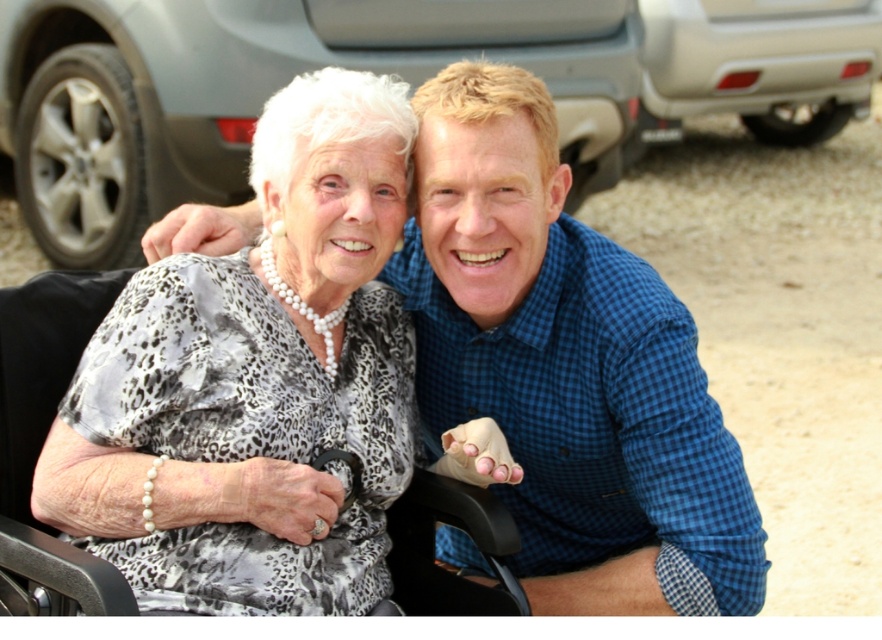
Does metallic gray car at upper center have a lesser height compared to silver metallic car at upper right?

Incorrect, metallic gray car at upper center's height does not fall short of silver metallic car at upper right's.

Is point (218, 193) more distant than point (686, 68)?

No, (218, 193) is in front of (686, 68).

This screenshot has height=640, width=882. In order to click on metallic gray car at upper center in this screenshot , I will do (x=258, y=92).

Which is behind, point (540, 600) or point (839, 51)?

Positioned behind is point (839, 51).

Does blue checkered shirt at center appear over silver metallic car at upper right?

Incorrect, blue checkered shirt at center is not positioned above silver metallic car at upper right.

Does point (699, 493) come in front of point (838, 97)?

Yes, point (699, 493) is closer to viewer.

The image size is (882, 640). I want to click on blue checkered shirt at center, so click(567, 368).

Consider the image. Between white pearl necklace at upper left and silver metallic car at upper right, which one is positioned higher?

Positioned higher is silver metallic car at upper right.

Find the location of a particular element. The width and height of the screenshot is (882, 640). white pearl necklace at upper left is located at coordinates (266, 372).

Describe the element at coordinates (266, 372) in the screenshot. I see `white pearl necklace at upper left` at that location.

Where is `white pearl necklace at upper left`? The height and width of the screenshot is (640, 882). white pearl necklace at upper left is located at coordinates (266, 372).